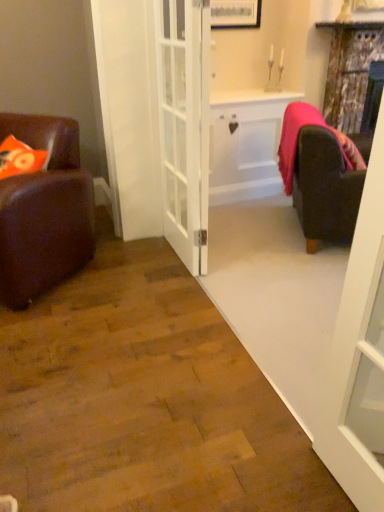
Question: Is distressed wood curtain at upper right at the right side of white glass door at right, which ranks as the 1th door in right-to-left order?

Choices:
 (A) yes
 (B) no

Answer: (A)

Question: Is distressed wood curtain at upper right facing away from white glass door at right, which ranks as the 1th door in right-to-left order?

Choices:
 (A) no
 (B) yes

Answer: (A)

Question: Considering the relative sizes of distressed wood curtain at upper right and white glass door at right, the 1th door from the front, in the image provided, is distressed wood curtain at upper right bigger than white glass door at right, the 1th door from the front,?

Choices:
 (A) yes
 (B) no

Answer: (A)

Question: From a real-world perspective, is distressed wood curtain at upper right physically below white glass door at right, which ranks as the 1th door in right-to-left order?

Choices:
 (A) no
 (B) yes

Answer: (A)

Question: From the image's perspective, would you say distressed wood curtain at upper right is shown under white glass door at right, the 2th door from the left?

Choices:
 (A) yes
 (B) no

Answer: (B)

Question: From a real-world perspective, is brown leather chair at left physically located above or below distressed wood curtain at upper right?

Choices:
 (A) below
 (B) above

Answer: (A)

Question: Would you say brown leather chair at left is inside or outside distressed wood curtain at upper right?

Choices:
 (A) outside
 (B) inside

Answer: (A)

Question: Looking at their shapes, would you say brown leather chair at left is wider or thinner than distressed wood curtain at upper right?

Choices:
 (A) wide
 (B) thin

Answer: (A)

Question: Is point (9, 266) closer or farther from the camera than point (357, 70)?

Choices:
 (A) farther
 (B) closer

Answer: (B)

Question: Is white glass door at center, which is counted as the first door, starting from the left, wider or thinner than white glass door at right, which ranks as the 1th door in right-to-left order?

Choices:
 (A) wide
 (B) thin

Answer: (A)

Question: From a real-world perspective, relative to white glass door at right, which ranks as the 1th door in right-to-left order, is white glass door at center, which is counted as the first door, starting from the left, vertically above or below?

Choices:
 (A) above
 (B) below

Answer: (A)

Question: Is white glass door at center, which is counted as the first door, starting from the left, in front of or behind white glass door at right, the 2th door from the left, in the image?

Choices:
 (A) front
 (B) behind

Answer: (B)

Question: From the image's perspective, is white glass door at center, the 1th door positioned from the back, located above or below white glass door at right, the second door when ordered from back to front?

Choices:
 (A) below
 (B) above

Answer: (B)

Question: From the image's perspective, is velvet dark brown armchair at right above or below brown leather chair at left?

Choices:
 (A) above
 (B) below

Answer: (A)

Question: Based on their sizes in the image, would you say velvet dark brown armchair at right is bigger or smaller than brown leather chair at left?

Choices:
 (A) small
 (B) big

Answer: (A)